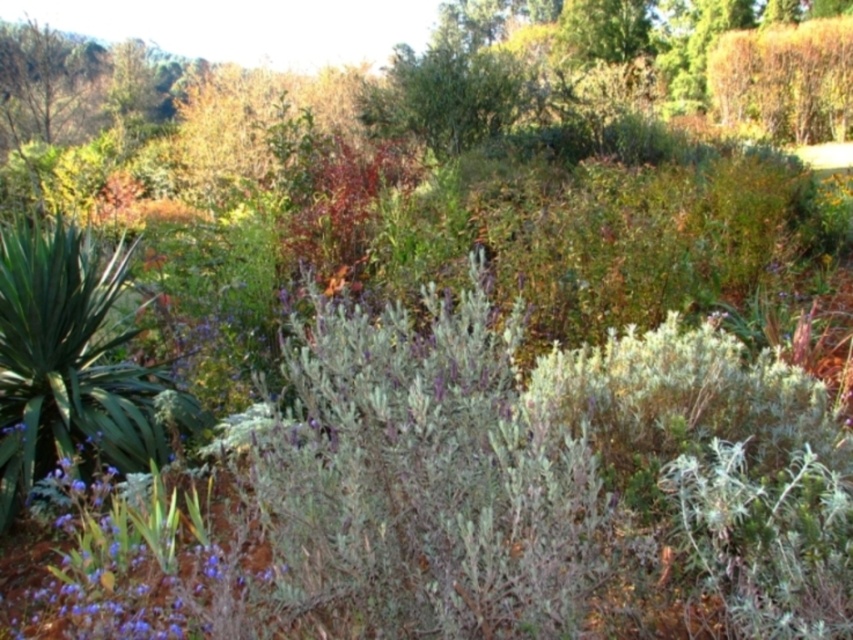
Question: Which of the following is the farthest from the observer?

Choices:
 (A) purple matte flower at lower left
 (B) green leafy plant at left

Answer: (B)

Question: Does green leafy plant at left have a smaller size compared to purple matte flower at lower left?

Choices:
 (A) yes
 (B) no

Answer: (B)

Question: Is green leafy plant at left bigger than purple matte flower at lower left?

Choices:
 (A) yes
 (B) no

Answer: (A)

Question: Which point is farther to the camera?

Choices:
 (A) (27, 566)
 (B) (119, 333)

Answer: (B)

Question: Which of the following is the closest to the observer?

Choices:
 (A) green leafy plant at left
 (B) purple matte flower at lower left

Answer: (B)

Question: Can you confirm if green leafy plant at left is positioned above purple matte flower at lower left?

Choices:
 (A) yes
 (B) no

Answer: (A)